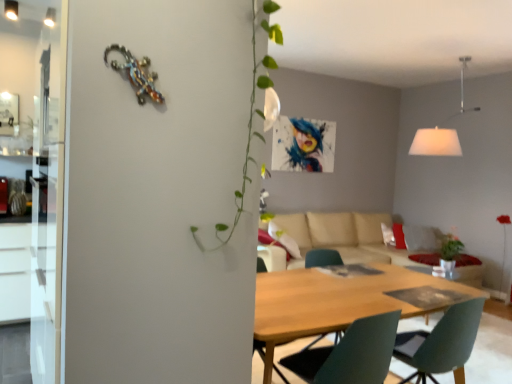
Question: Looking at the image, does matte green chair at center seem bigger or smaller compared to wooden table at center?

Choices:
 (A) big
 (B) small

Answer: (B)

Question: From a real-world perspective, is matte green chair at center positioned above or below wooden table at center?

Choices:
 (A) below
 (B) above

Answer: (B)

Question: Which object is positioned closest to the matte green chair at center?

Choices:
 (A) wooden table at center
 (B) white fabric lampshade at upper right
 (C) beige fabric couch at center

Answer: (A)

Question: Estimate the real-world distances between objects in this image. Which object is closer to the white fabric lampshade at upper right?

Choices:
 (A) beige fabric couch at center
 (B) wooden table at center
 (C) matte green chair at center

Answer: (A)